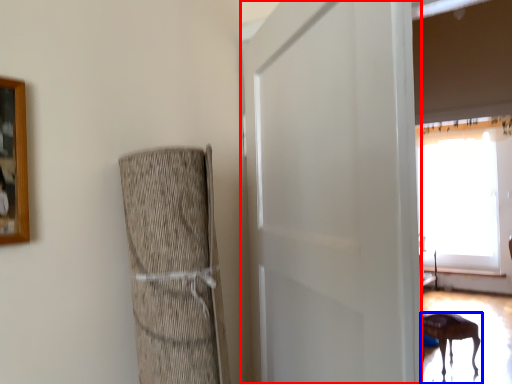
Question: Which object is closer to the camera taking this photo, screen door (highlighted by a red box) or furniture (highlighted by a blue box)?

Choices:
 (A) screen door
 (B) furniture

Answer: (A)